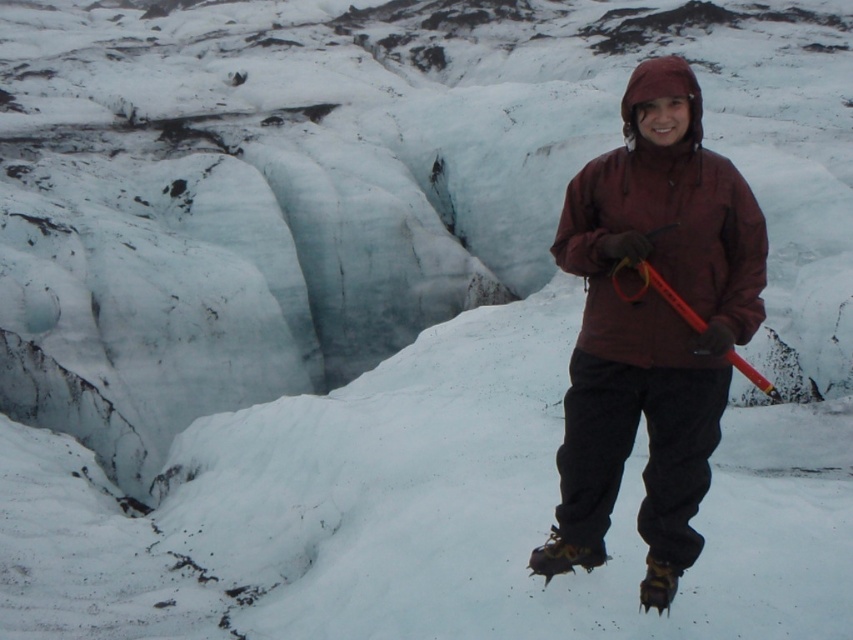
Is maroon fleece jacket at center above orange plastic ski pole at center?

Indeed, maroon fleece jacket at center is positioned over orange plastic ski pole at center.

In order to click on maroon fleece jacket at center in this screenshot , I will do `click(664, 236)`.

Is point (572, 228) behind point (759, 388)?

No, it is not.

You are a GUI agent. You are given a task and a screenshot of the screen. Output one action in this format:
    pyautogui.click(x=<x>, y=<y>)
    Task: Click on the maroon fleece jacket at center
    
    Given the screenshot: What is the action you would take?
    pyautogui.click(x=664, y=236)